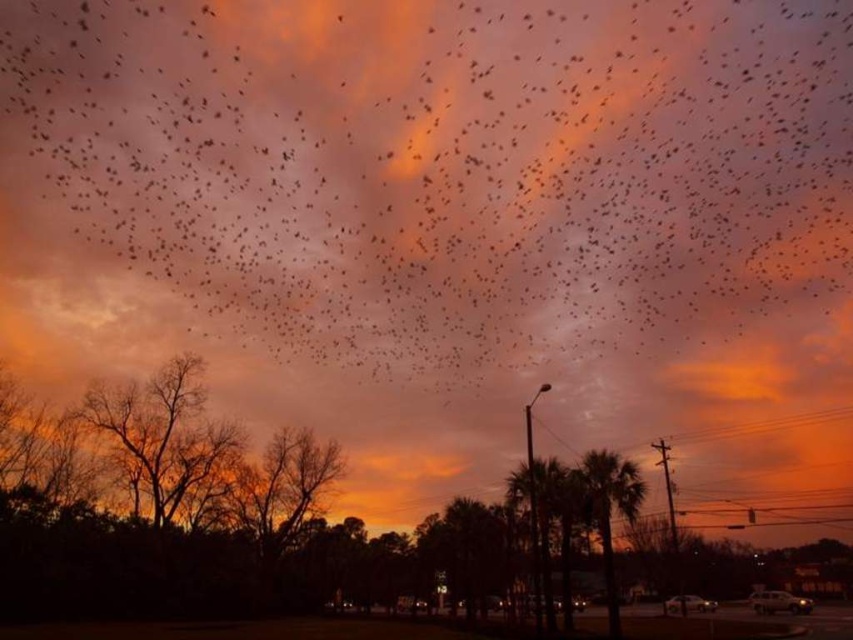
Question: Can you confirm if brown leafless tree at left is positioned above green leafy palm tree at center?

Choices:
 (A) yes
 (B) no

Answer: (A)

Question: Is black matte birds at upper center to the right of green leafy palm tree at center from the viewer's perspective?

Choices:
 (A) yes
 (B) no

Answer: (B)

Question: Estimate the real-world distances between objects in this image. Which object is farther from the brown leafless tree at left?

Choices:
 (A) black matte birds at upper center
 (B) green leafy palm tree at center

Answer: (B)

Question: Does brown leafless tree at left have a lesser width compared to green leafy palm tree at center?

Choices:
 (A) yes
 (B) no

Answer: (B)

Question: Which of these objects is positioned farthest from the brown leafless tree at left?

Choices:
 (A) green leafy palm tree at center
 (B) black matte birds at upper center

Answer: (A)

Question: Which of these objects is positioned closest to the brown leafless tree at left?

Choices:
 (A) black matte birds at upper center
 (B) green leafy palm tree at center

Answer: (A)